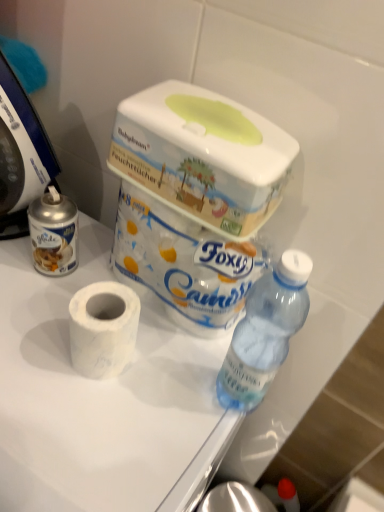
Locate an element on the screen. The height and width of the screenshot is (512, 384). free space to the left of white marble toilet paper at center, which is the 1th toilet paper in top-to-bottom order is located at coordinates 59,278.